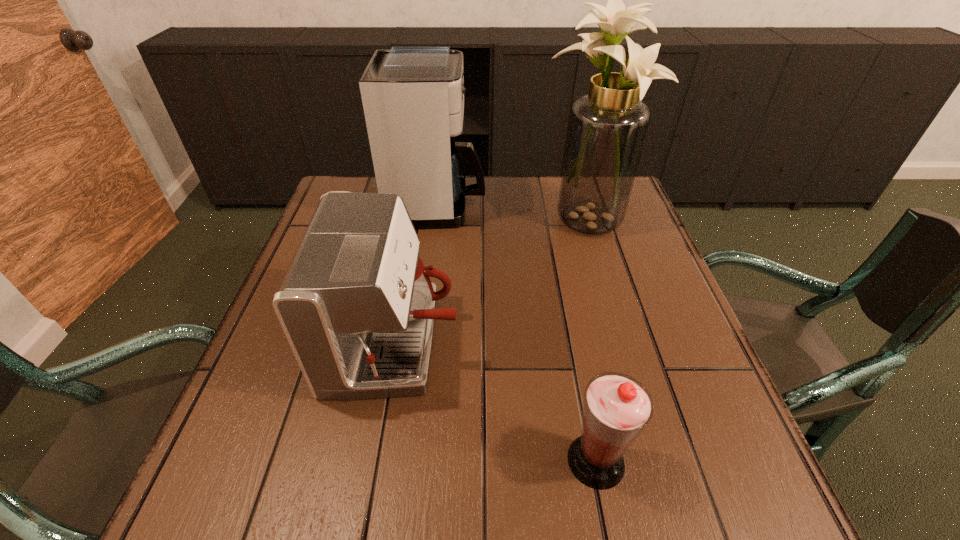
Locate an element on the screen. vacant area between the nearer coffee maker and the tallest object is located at coordinates point(492,282).

Where is `object that is the second closest one to the second nearest object`? This screenshot has height=540, width=960. object that is the second closest one to the second nearest object is located at coordinates (413, 96).

You are a GUI agent. You are given a task and a screenshot of the screen. Output one action in this format:
    pyautogui.click(x=<x>, y=<y>)
    Task: Click on the object that is the third nearest to the third tallest object
    This screenshot has height=540, width=960.
    Given the screenshot: What is the action you would take?
    pyautogui.click(x=607, y=128)

I want to click on free space that satisfies the following two spatial constraints: 1. on the front panel of the taller coffee maker; 2. on the right side of the shortest object, so click(406, 461).

Locate an element on the screen. vacant space that satisfies the following two spatial constraints: 1. on the front side of the tallest object; 2. on the front of the third farthest object near the spout is located at coordinates (624, 343).

The height and width of the screenshot is (540, 960). Find the location of `free space that satisfies the following two spatial constraints: 1. on the front of the third farthest object near the spout; 2. on the back side of the smoothie`. free space that satisfies the following two spatial constraints: 1. on the front of the third farthest object near the spout; 2. on the back side of the smoothie is located at coordinates (374, 461).

This screenshot has width=960, height=540. I want to click on vacant position in the image that satisfies the following two spatial constraints: 1. on the front of the nearer coffee maker near the spout; 2. on the back side of the shortest object, so click(374, 461).

What are the coordinates of `vacant region that satisfies the following two spatial constraints: 1. on the front panel of the tallest object; 2. on the left side of the second tallest object` in the screenshot? It's located at (436, 221).

Find the location of a particular element. The height and width of the screenshot is (540, 960). vacant space that satisfies the following two spatial constraints: 1. on the front of the shorter coffee maker near the spout; 2. on the right side of the shortest object is located at coordinates (374, 461).

Where is `free space in the image that satisfies the following two spatial constraints: 1. on the back side of the smoothie; 2. on the right side of the flower arrangement`? free space in the image that satisfies the following two spatial constraints: 1. on the back side of the smoothie; 2. on the right side of the flower arrangement is located at coordinates (549, 221).